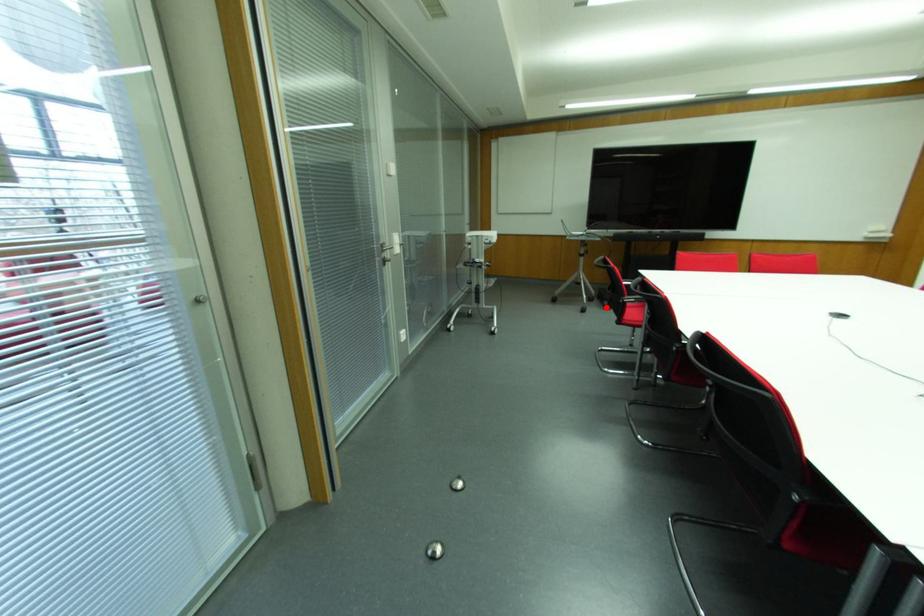
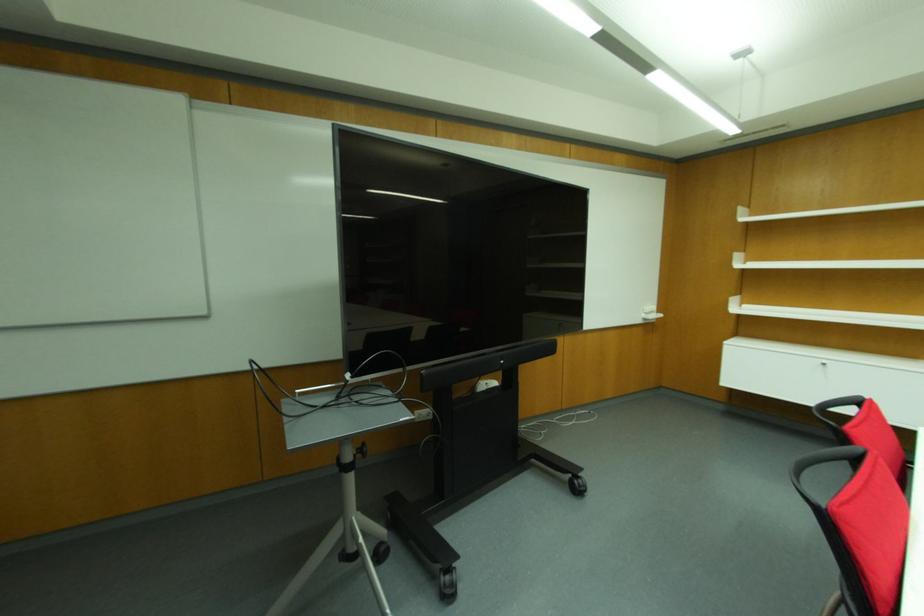
Question: A red point is marked in image1. In image2, is the corresponding 3D point closer to the camera or farther? Reply with the corresponding letter.

Choices:
 (A) The corresponding 3D point is closer.
 (B) The corresponding 3D point is farther.

Answer: (B)